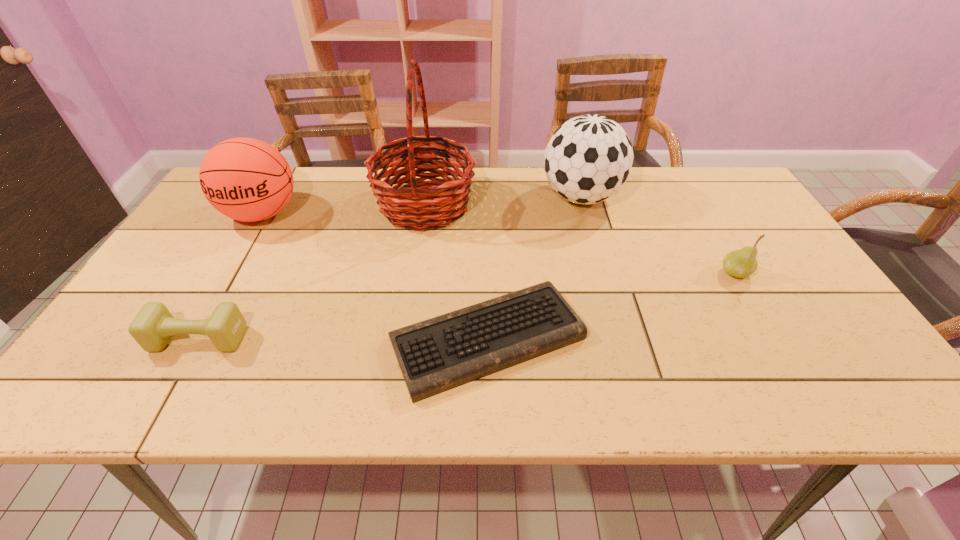
Find the location of a particular element. the tallest object is located at coordinates (409, 207).

You are a GUI agent. You are given a task and a screenshot of the screen. Output one action in this format:
    pyautogui.click(x=<x>, y=<y>)
    Task: Click on the soccer ball
    The image size is (960, 540).
    Given the screenshot: What is the action you would take?
    pyautogui.click(x=588, y=159)

Find the location of a particular element. basketball is located at coordinates (246, 179).

What are the coordinates of `the rightmost object` in the screenshot? It's located at (741, 263).

You are a GUI agent. You are given a task and a screenshot of the screen. Output one action in this format:
    pyautogui.click(x=<x>, y=<y>)
    Task: Click on the fourth farthest object
    
    Given the screenshot: What is the action you would take?
    pyautogui.click(x=741, y=263)

What are the coordinates of `dumbbell` in the screenshot? It's located at (152, 328).

This screenshot has height=540, width=960. In order to click on computer keyboard in this screenshot , I will do `click(435, 355)`.

You are a GUI agent. You are given a task and a screenshot of the screen. Output one action in this format:
    pyautogui.click(x=<x>, y=<y>)
    Task: Click on the free space located on the front of the basket
    This screenshot has width=960, height=540.
    Given the screenshot: What is the action you would take?
    pyautogui.click(x=409, y=309)

Locate an element on the screen. The height and width of the screenshot is (540, 960). vacant region located 0.070m on the right of the soccer ball is located at coordinates (643, 197).

Identify the location of blank space located on the side with logo of the basketball. (210, 305).